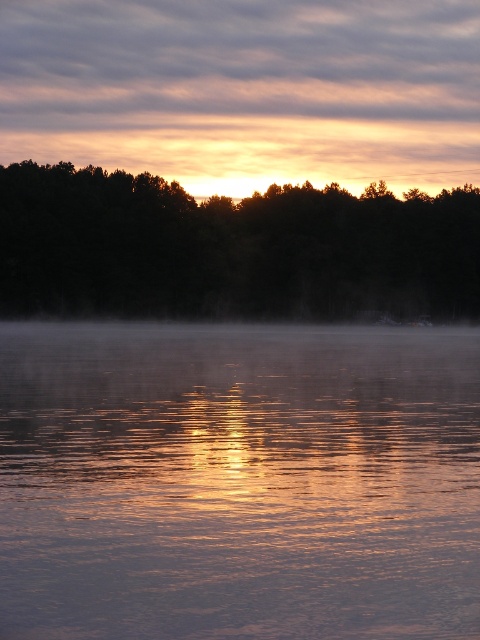
You are an artist trying to paint the scene. You want to ensure the glistening water at center and dark green forest at center are proportionally accurate. Which object should you make wider in your painting?

Answer: The dark green forest at center should be wider since the glistening water at center is narrower than the dark green forest at center according to the description.

You are standing at the edge of the water in the scene. Which object, the glistening water at center or the dark green forest at center, would appear larger to you?

The glistening water at center would appear larger because it is closer to the viewer than the dark green forest at center.